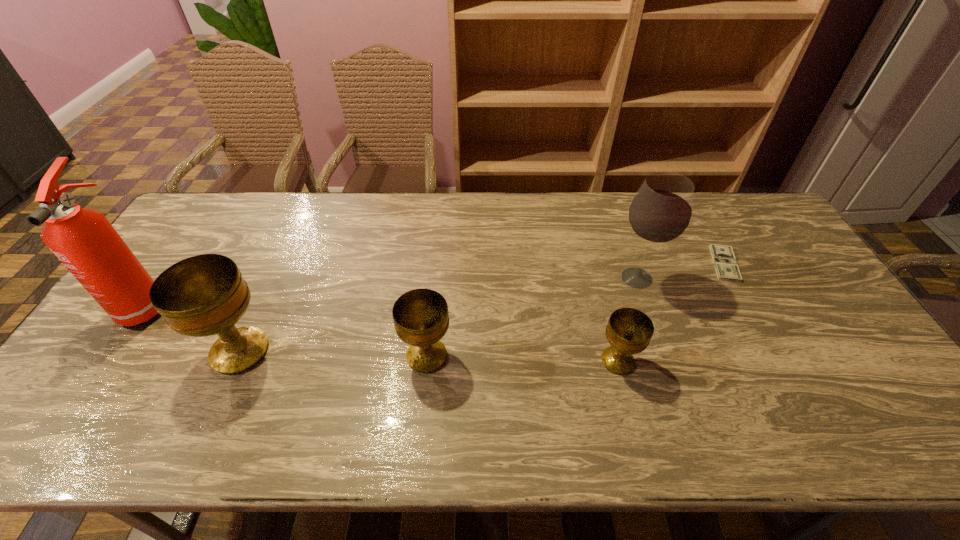
Image resolution: width=960 pixels, height=540 pixels. I want to click on alcohol, so click(660, 212).

Locate an element on the screen. vacant area situated 0.120m on the back of the fourth shortest object is located at coordinates (267, 291).

I want to click on vacant area situated on the left of the second tallest chalice, so click(378, 356).

Identify the location of free location located 0.390m on the left of the fifth tallest object. (444, 361).

Locate an element on the screen. vacant space situated 0.130m on the right of the shortest object is located at coordinates [x=780, y=264].

At what (x,y) coordinates should I click in order to perform the action: click on free location located 0.220m at the nozzle of the leftmost object. Please return your answer as a coordinate pair (x, y). This screenshot has width=960, height=540. Looking at the image, I should click on (78, 405).

Where is `vacant space located 0.360m on the right of the second tallest object`? The width and height of the screenshot is (960, 540). vacant space located 0.360m on the right of the second tallest object is located at coordinates (783, 278).

Identify the location of object present at the left edge. (86, 243).

Identify the location of free space at the far edge. (508, 195).

Where is `vacant position at the near edge of the desktop`? vacant position at the near edge of the desktop is located at coordinates (470, 395).